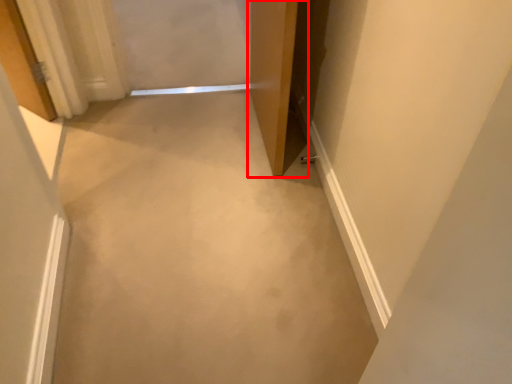
Question: From the image's perspective, what is the correct spatial positioning of door (annotated by the red box) in reference to concrete?

Choices:
 (A) below
 (B) above

Answer: (B)